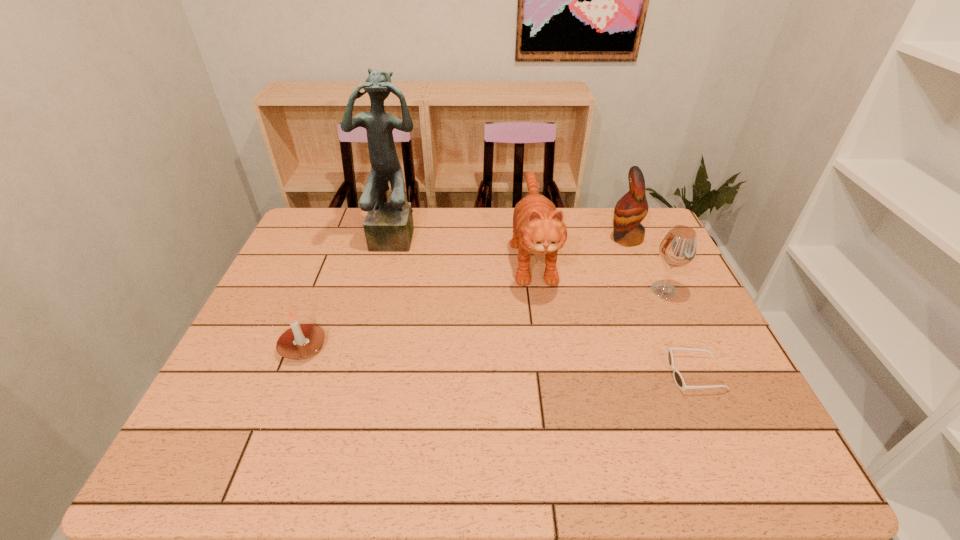
Identify the location of free point at the far right corner. (664, 238).

The height and width of the screenshot is (540, 960). Identify the location of vacant space at the near right corner of the desktop. (763, 449).

Where is `blank region between the fourth tallest object and the sculpture`? This screenshot has height=540, width=960. blank region between the fourth tallest object and the sculpture is located at coordinates 531,262.

Where is `blank region between the candle and the parrot`? blank region between the candle and the parrot is located at coordinates (465, 293).

Where is `free spot between the cat and the tallest object`? The image size is (960, 540). free spot between the cat and the tallest object is located at coordinates (466, 245).

Locate an element on the screen. The height and width of the screenshot is (540, 960). vacant area between the sunglasses and the leftmost object is located at coordinates (499, 360).

Image resolution: width=960 pixels, height=540 pixels. Identify the location of vacant point located between the second shortest object and the fourth object from right to left. (418, 300).

Where is `free space between the third object from left to right and the shortest object`? This screenshot has width=960, height=540. free space between the third object from left to right and the shortest object is located at coordinates (613, 313).

Identify the location of vacant point located between the fourth object from right to left and the sunglasses. The image size is (960, 540). (613, 313).

You are a GUI agent. You are given a task and a screenshot of the screen. Output one action in this format:
    pyautogui.click(x=<x>, y=<y>)
    Task: Click on the vacant space in between the third shortest object and the second object from left to right
    Image resolution: width=960 pixels, height=540 pixels.
    Given the screenshot: What is the action you would take?
    pyautogui.click(x=531, y=262)